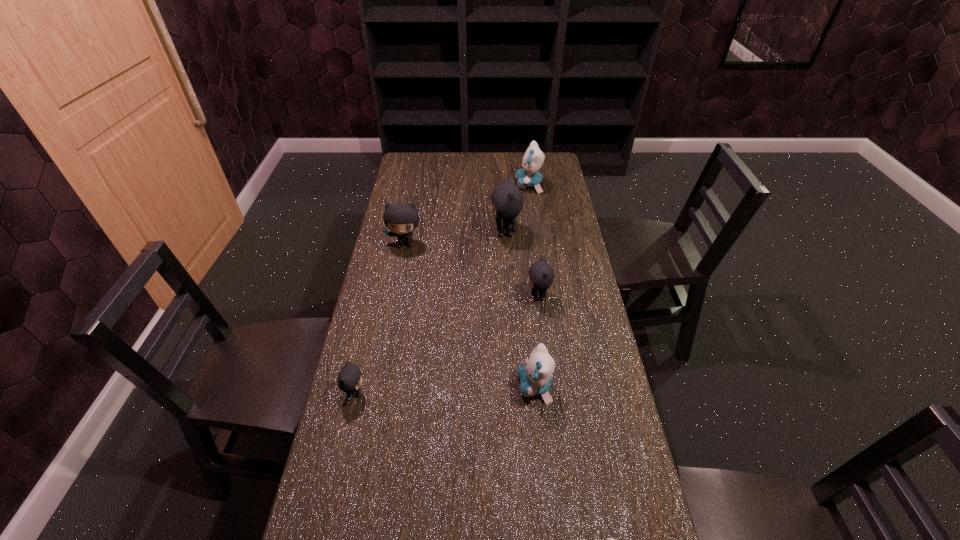
Identify which blue kitten is located as the second nearest to the second biggest gray kitten. Please provide its 2D coordinates. Your answer should be formatted as a tuple, i.e. [(x, y)], where the tuple contains the x and y coordinates of a point satisfying the conditions above.

[(535, 377)]